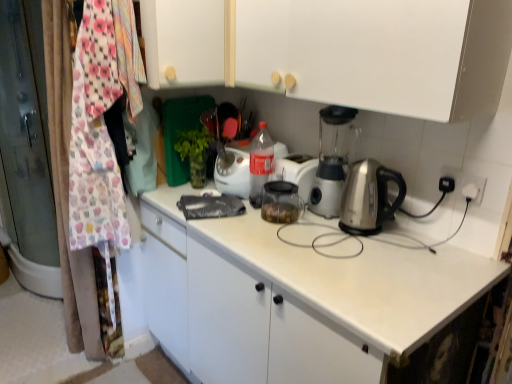
Question: Which direction should I rotate to face white matte cabinet at upper center, placed as the 1th cabinetry when sorted from right to left, — up or down?

Choices:
 (A) up
 (B) down

Answer: (A)

Question: From the image's perspective, is translucent plastic bottle at center under white matte cabinet at upper center, positioned as the 1th cabinetry in left-to-right order?

Choices:
 (A) yes
 (B) no

Answer: (A)

Question: Is translucent plastic bottle at center positioned with its back to white matte cabinet at upper center, positioned as the 2th cabinetry in right-to-left order?

Choices:
 (A) no
 (B) yes

Answer: (A)

Question: Can you confirm if translucent plastic bottle at center is smaller than white matte cabinet at upper center, positioned as the 1th cabinetry in left-to-right order?

Choices:
 (A) no
 (B) yes

Answer: (B)

Question: From a real-world perspective, is translucent plastic bottle at center located beneath white matte cabinet at upper center, positioned as the 2th cabinetry in right-to-left order?

Choices:
 (A) yes
 (B) no

Answer: (A)

Question: From a real-world perspective, is translucent plastic bottle at center over white matte cabinet at upper center, positioned as the 2th cabinetry in right-to-left order?

Choices:
 (A) yes
 (B) no

Answer: (B)

Question: Is translucent plastic bottle at center at the left side of white matte cabinet at upper center, positioned as the 1th cabinetry in left-to-right order?

Choices:
 (A) no
 (B) yes

Answer: (A)

Question: Considering the relative positions of white matte cabinet at upper center, positioned as the 2th cabinetry in left-to-right order, and white matte cabinet at upper center, positioned as the 1th cabinetry in left-to-right order, in the image provided, is white matte cabinet at upper center, positioned as the 2th cabinetry in left-to-right order, in front of white matte cabinet at upper center, positioned as the 1th cabinetry in left-to-right order,?

Choices:
 (A) no
 (B) yes

Answer: (B)

Question: Considering the relative sizes of white matte cabinet at upper center, placed as the 1th cabinetry when sorted from right to left, and white matte cabinet at upper center, positioned as the 1th cabinetry in left-to-right order, in the image provided, is white matte cabinet at upper center, placed as the 1th cabinetry when sorted from right to left, shorter than white matte cabinet at upper center, positioned as the 1th cabinetry in left-to-right order,?

Choices:
 (A) no
 (B) yes

Answer: (B)

Question: From the image's perspective, is white matte cabinet at upper center, positioned as the 2th cabinetry in left-to-right order, beneath white matte cabinet at upper center, positioned as the 1th cabinetry in left-to-right order?

Choices:
 (A) no
 (B) yes

Answer: (B)

Question: From a real-world perspective, is white matte cabinet at upper center, placed as the 1th cabinetry when sorted from right to left, on top of white matte cabinet at upper center, positioned as the 2th cabinetry in right-to-left order?

Choices:
 (A) yes
 (B) no

Answer: (B)

Question: From the image's perspective, is white matte cabinet at upper center, positioned as the 2th cabinetry in left-to-right order, located above white matte cabinet at upper center, positioned as the 2th cabinetry in right-to-left order?

Choices:
 (A) no
 (B) yes

Answer: (A)

Question: Is white matte cabinet at upper center, placed as the 1th cabinetry when sorted from right to left, thinner than white matte cabinet at upper center, positioned as the 2th cabinetry in right-to-left order?

Choices:
 (A) yes
 (B) no

Answer: (A)

Question: Is white matte cabinet at upper center, positioned as the 1th cabinetry in left-to-right order, further to the viewer compared to translucent plastic bottle at center?

Choices:
 (A) yes
 (B) no

Answer: (B)